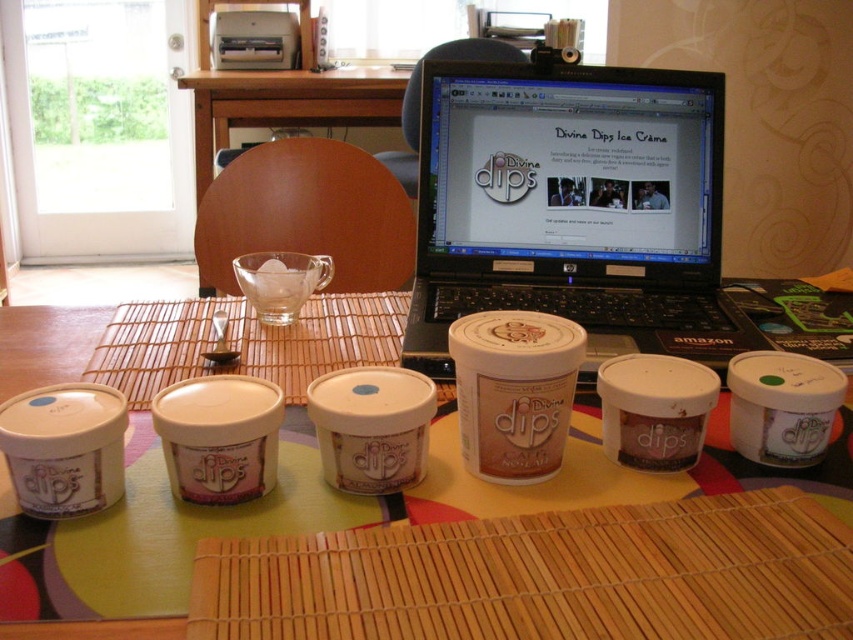
Measure the distance between black plastic laptop at upper center and white matte container at center.

They are 11.85 inches apart.

Who is lower down, black plastic laptop at upper center or white matte container at center?

white matte container at center is below.

The image size is (853, 640). I want to click on black plastic laptop at upper center, so click(x=573, y=209).

Locate an element on the screen. black plastic laptop at upper center is located at coordinates (573, 209).

Is black plastic laptop at upper center bigger than green fabric table at center?

Actually, black plastic laptop at upper center might be smaller than green fabric table at center.

Measure the distance from black plastic laptop at upper center to green fabric table at center.

black plastic laptop at upper center and green fabric table at center are 8.37 inches apart.

Who is more forward, (651, 266) or (115, 621)?

Point (115, 621)

What are the coordinates of `black plastic laptop at upper center` in the screenshot? It's located at (573, 209).

Is white matte container at center bigger than green fabric table at center?

No.

Does white matte container at center lie in front of green fabric table at center?

No.

Which is behind, point (477, 342) or point (440, 388)?

The point (440, 388) is behind.

Identify the location of white matte container at center. (514, 392).